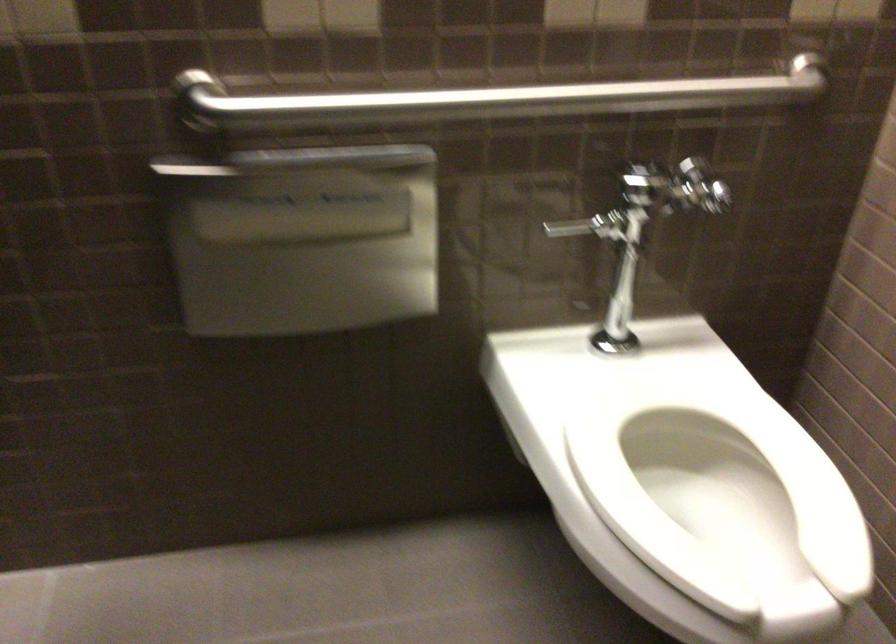
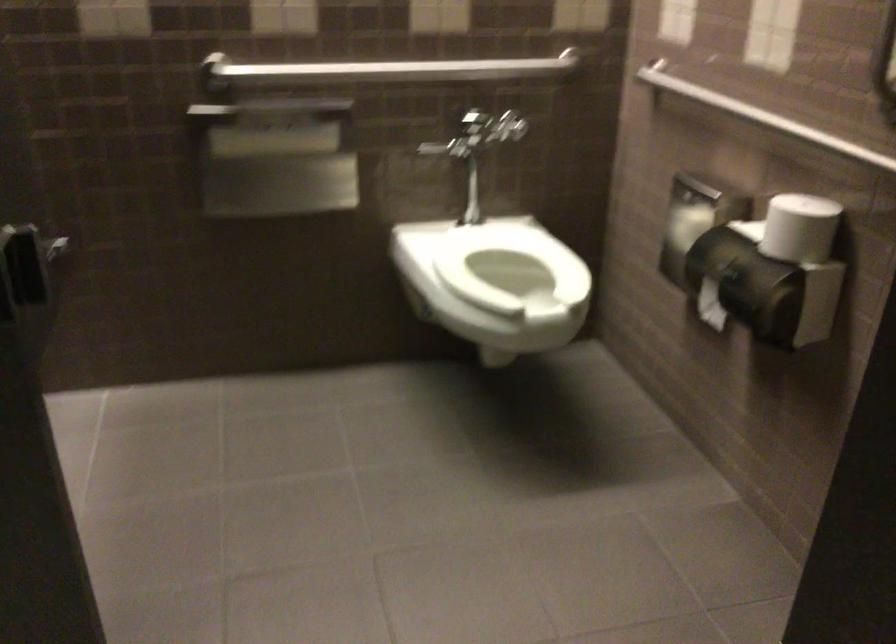
Find the pixel in the second image that matches point 304,230 in the first image.

(273, 143)